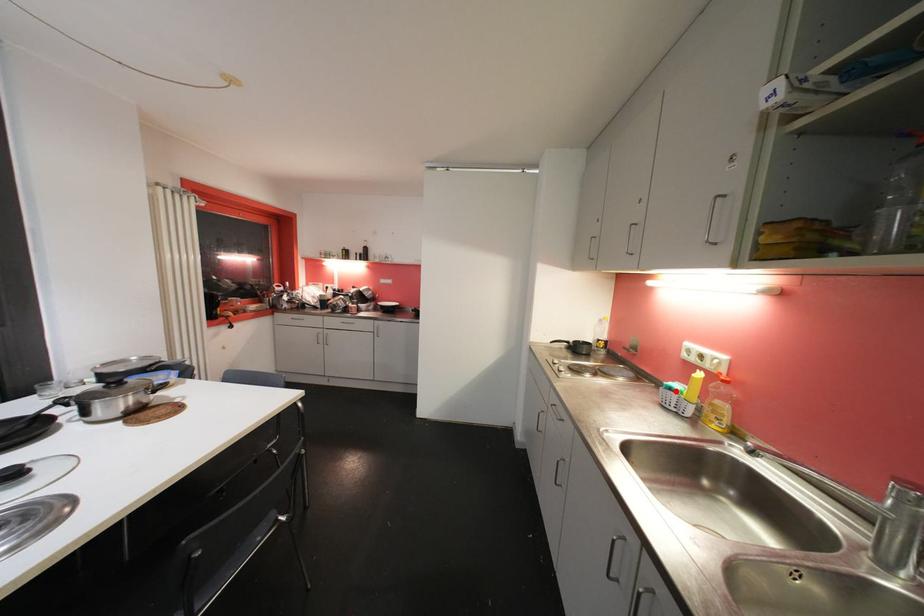
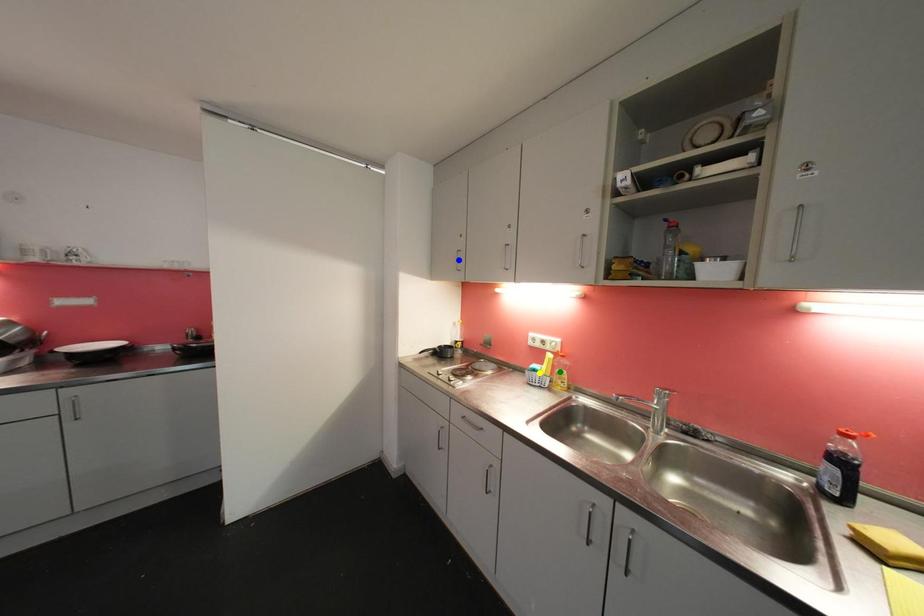
Question: I am providing you with two images of the same scene from different viewpoints. A red point is marked on the first image. You are given multiple points on the second image. Can you choose the point in image 2 that corresponds to the point in image 1?

Choices:
 (A) yellow point
 (B) blue point
 (C) green point

Answer: (A)